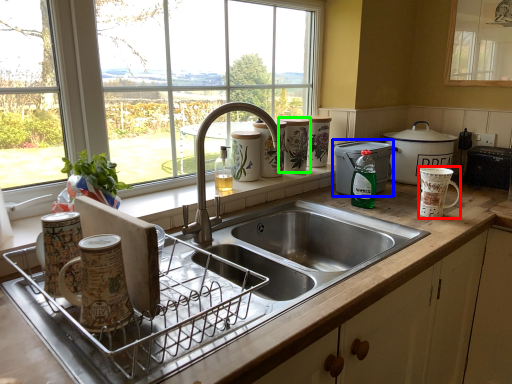
Question: Estimate the real-world distances between objects in this image. Which object is farther from mug (highlighted by a red box), appliance (highlighted by a blue box) or appliance (highlighted by a green box)?

Choices:
 (A) appliance
 (B) appliance

Answer: (B)